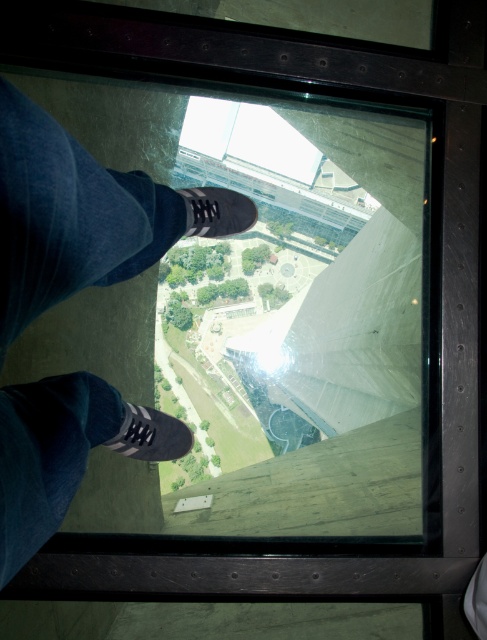
Which is more to the right, dark blue jeans at center or black suede shoe at lower left?

Positioned to the right is dark blue jeans at center.

Who is lower down, dark blue jeans at center or black suede shoe at lower left?

Positioned lower is black suede shoe at lower left.

The height and width of the screenshot is (640, 487). Identify the location of dark blue jeans at center. (69, 216).

Does dark blue jeans at center come in front of black suede shoe at center?

Yes.

Which of these two, dark blue jeans at center or black suede shoe at center, stands taller?

dark blue jeans at center is taller.

Does point (30, 305) come in front of point (207, 208)?

Yes, it is in front of point (207, 208).

Image resolution: width=487 pixels, height=640 pixels. I want to click on dark blue jeans at center, so click(x=69, y=216).

Does black suede shoe at lower left have a lesser width compared to black suede shoe at center?

No, black suede shoe at lower left is not thinner than black suede shoe at center.

Between point (124, 452) and point (190, 212), which one is positioned in front?

Point (190, 212) is in front.

Is point (173, 417) less distant than point (187, 225)?

No, (173, 417) is behind (187, 225).

The height and width of the screenshot is (640, 487). Find the location of `black suede shoe at lower left`. black suede shoe at lower left is located at coordinates (150, 435).